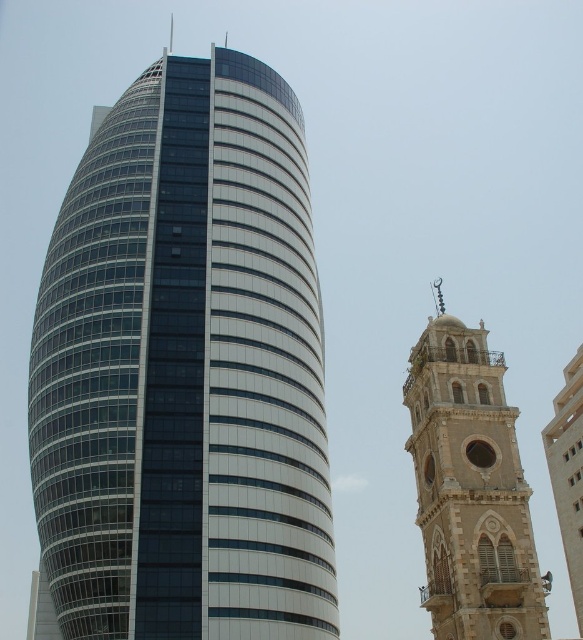
Between glassy steel tower at center and stone tower at right, which one appears on the left side from the viewer's perspective?

glassy steel tower at center is more to the left.

Measure the distance from glassy steel tower at center to stone tower at right.

They are 62.06 feet apart.

Between point (51, 268) and point (417, 387), which one is positioned behind?

The point (51, 268) is behind.

The height and width of the screenshot is (640, 583). Identify the location of glassy steel tower at center. (184, 371).